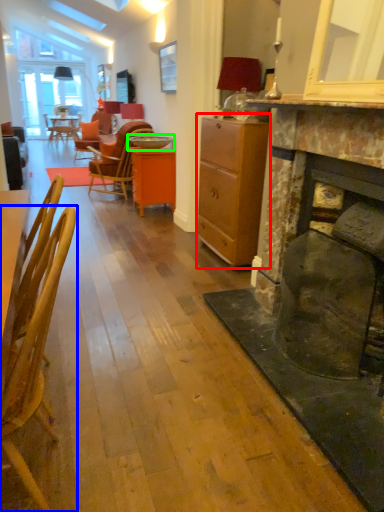
Question: Which object is positioned farthest from cabinetry (highlighted by a red box)? Select from chair (highlighted by a blue box) and round table (highlighted by a green box).

Choices:
 (A) chair
 (B) round table

Answer: (A)